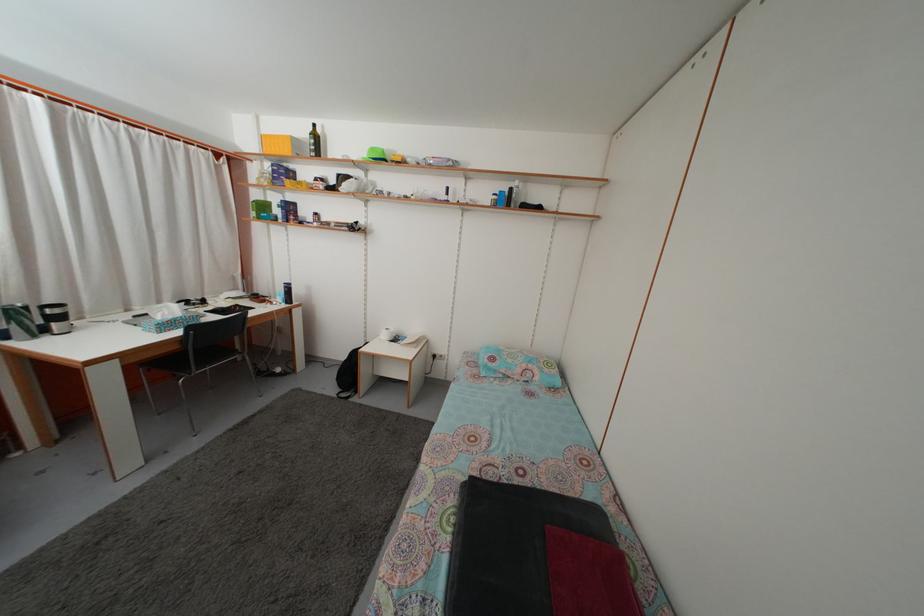
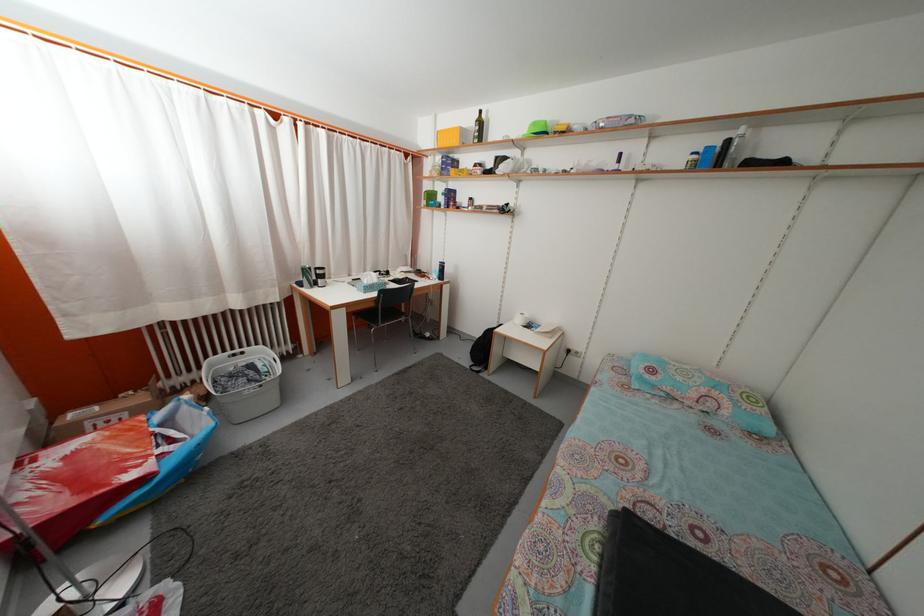
The point at (300, 148) is marked in the first image. Where is the corresponding point in the second image?

(468, 139)